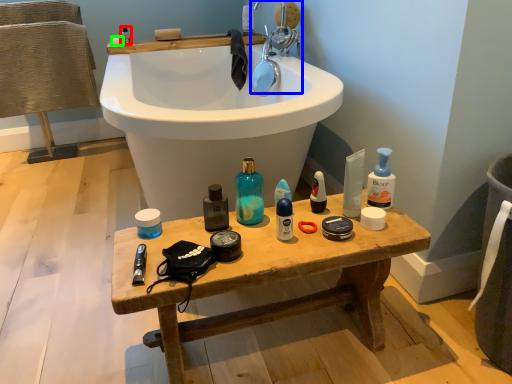
Question: Which is nearer to the toiletry (highlighted by a red box)? tap (highlighted by a blue box) or soap (highlighted by a green box).

Choices:
 (A) tap
 (B) soap

Answer: (B)